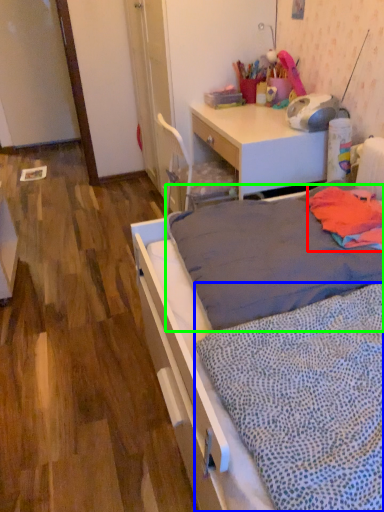
Question: Estimate the real-world distances between objects in this image. Which object is closer to blanket (highlighted by a red box), blanket (highlighted by a blue box) or mattress (highlighted by a green box)?

Choices:
 (A) blanket
 (B) mattress

Answer: (B)